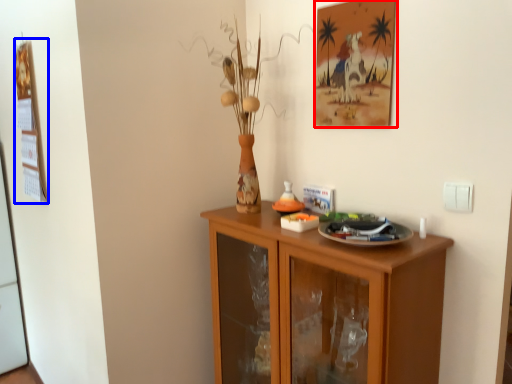
Question: Among these objects, which one is nearest to the camera, picture frame (highlighted by a red box) or picture frame (highlighted by a blue box)?

Choices:
 (A) picture frame
 (B) picture frame

Answer: (A)